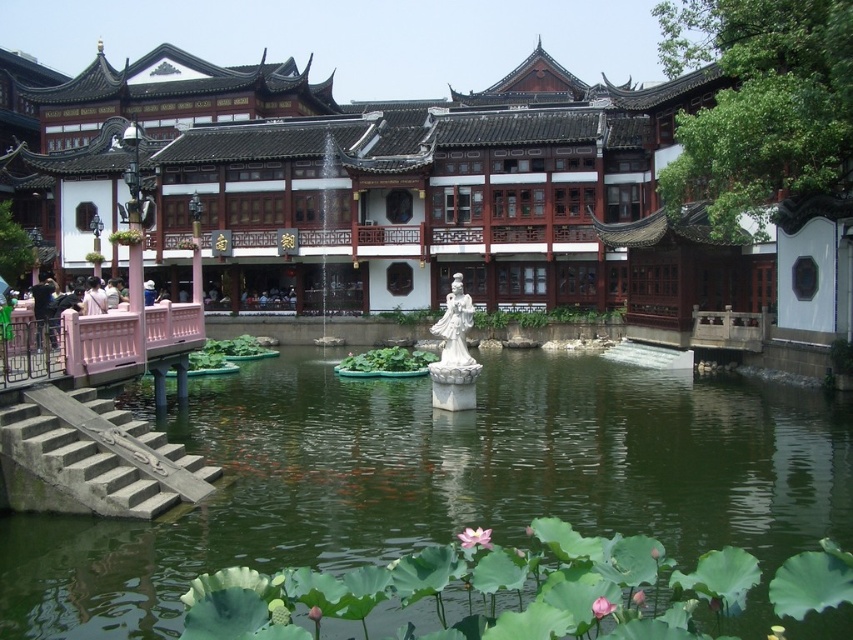
Between green water at center and white marble statue at center, which one has less height?

green water at center

Is point (590, 442) closer to viewer compared to point (463, 355)?

Yes, it is in front of point (463, 355).

Find the location of a particular element. green water at center is located at coordinates (456, 476).

Does point (280, 369) come closer to viewer compared to point (62, 490)?

No, (280, 369) is further to viewer.

Which is in front, point (521, 417) or point (19, 509)?

Point (19, 509) is more forward.

This screenshot has width=853, height=640. I want to click on green water at center, so click(x=456, y=476).

Find the location of a particular element. The width and height of the screenshot is (853, 640). green water at center is located at coordinates (456, 476).

Can you confirm if smooth white statue at center is positioned below white marble statue at center?

A: Actually, smooth white statue at center is above white marble statue at center.

Is point (509, 298) positioned behind point (462, 387)?

Yes.

Does point (543, 298) lie behind point (462, 401)?

Yes, point (543, 298) is farther from viewer.

Identify the location of smooth white statue at center. The image size is (853, 640). (367, 180).